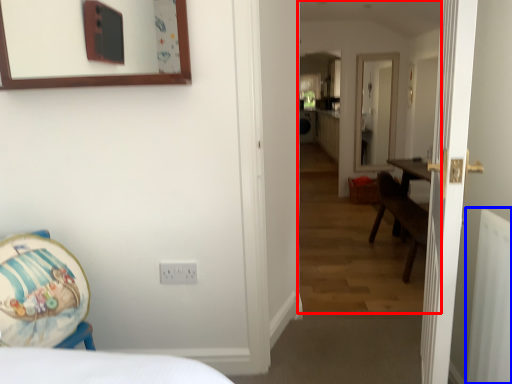
Question: Which of the following is the farthest to the observer, corridor (highlighted by a red box) or radiator (highlighted by a blue box)?

Choices:
 (A) corridor
 (B) radiator

Answer: (A)